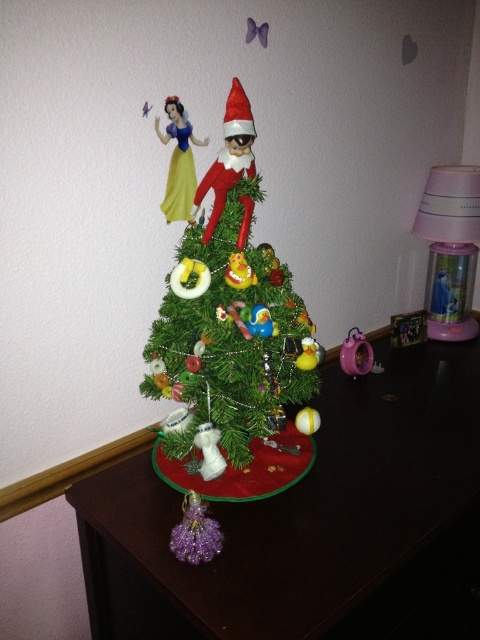
I want to click on green matte christmas tree at center, so click(228, 321).

In the scene shown: Between green matte christmas tree at center and yellow satin dress at upper left, which one has less height?

With less height is yellow satin dress at upper left.

Which is in front, point (232, 241) or point (175, 147)?

Positioned in front is point (232, 241).

The image size is (480, 640). Find the location of `green matte christmas tree at center`. green matte christmas tree at center is located at coordinates (228, 321).

Does green matte christmas tree at center appear under pink plastic clock at lower right?

No, green matte christmas tree at center is not below pink plastic clock at lower right.

Can you confirm if green matte christmas tree at center is positioned to the left of pink plastic clock at lower right?

Yes, green matte christmas tree at center is to the left of pink plastic clock at lower right.

Identify the location of green matte christmas tree at center. (228, 321).

Is dark brown wooden table at center to the left of green matte christmas tree at center from the viewer's perspective?

In fact, dark brown wooden table at center is to the right of green matte christmas tree at center.

Does dark brown wooden table at center have a greater width compared to green matte christmas tree at center?

Yes, dark brown wooden table at center is wider than green matte christmas tree at center.

This screenshot has width=480, height=640. What do you see at coordinates (313, 524) in the screenshot?
I see `dark brown wooden table at center` at bounding box center [313, 524].

This screenshot has height=640, width=480. What are the coordinates of `dark brown wooden table at center` in the screenshot? It's located at (313, 524).